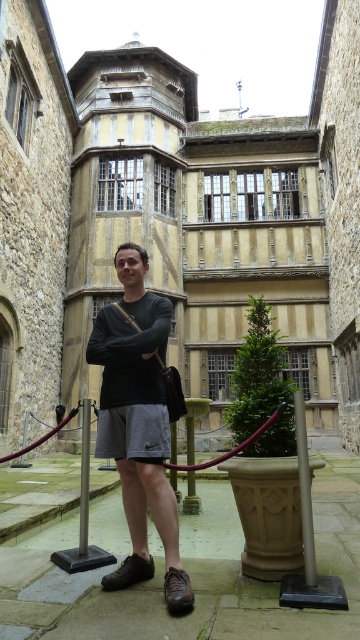
Question: Which of the following is the closest to the observer?

Choices:
 (A) (334, 129)
 (B) (106, 355)
 (C) (303, 484)

Answer: (C)

Question: Among these objects, which one is farthest from the camera?

Choices:
 (A) wooden balcony at center
 (B) brown polished pole at center

Answer: (A)

Question: Can you confirm if black sweater at center is wider than brown polished pole at center?

Choices:
 (A) yes
 (B) no

Answer: (A)

Question: Does wooden balcony at center appear under brown polished pole at center?

Choices:
 (A) no
 (B) yes

Answer: (A)

Question: Which of the following is the farthest from the observer?

Choices:
 (A) brown polished pole at center
 (B) black sweater at center
 (C) wooden balcony at center

Answer: (C)

Question: Can you confirm if wooden balcony at center is thinner than brown polished pole at center?

Choices:
 (A) yes
 (B) no

Answer: (B)